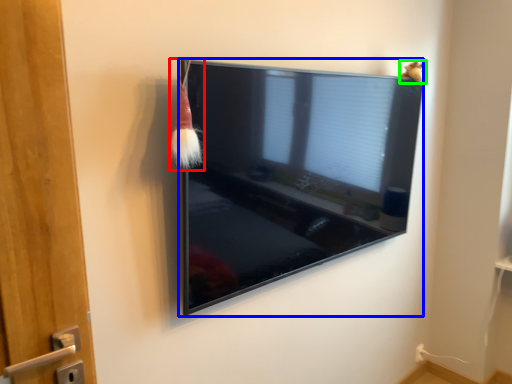
Question: Estimate the real-world distances between objects in this image. Which object is closer to brush (highlighted by a red box), television (highlighted by a blue box) or animal (highlighted by a green box)?

Choices:
 (A) television
 (B) animal

Answer: (A)